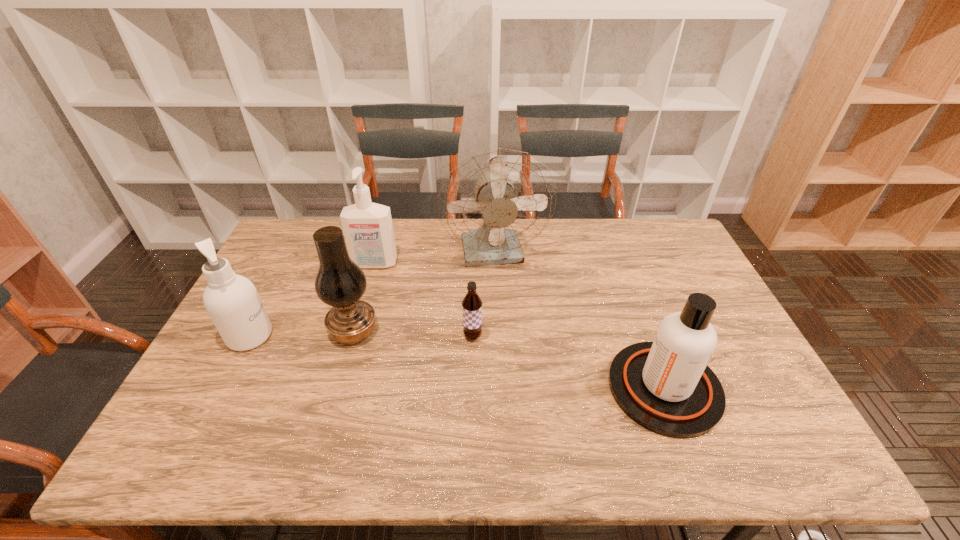
In order to click on unoccupied area between the fan and the rightmost object in this screenshot , I will do `click(580, 321)`.

This screenshot has height=540, width=960. I want to click on vacant point located between the leftmost cleansing agent and the second cleansing agent from left to right, so click(x=312, y=300).

Where is `vacant space in between the fan and the farthest cleansing agent`? This screenshot has height=540, width=960. vacant space in between the fan and the farthest cleansing agent is located at coordinates (435, 259).

Locate an element on the screen. The image size is (960, 540). object that stands as the closest to the rightmost cleansing agent is located at coordinates (494, 202).

Locate which object ranks fourth in proximity to the fan. Please provide its 2D coordinates. Your answer should be formatted as a tuple, i.e. [(x, y)], where the tuple contains the x and y coordinates of a point satisfying the conditions above.

[(665, 386)]

Locate an element on the screen. This screenshot has height=540, width=960. the second closest cleansing agent relative to the rightmost cleansing agent is located at coordinates (232, 301).

At what (x,y) coordinates should I click in order to perform the action: click on the closest cleansing agent to the leftmost object. Please return your answer as a coordinate pair (x, y). Image resolution: width=960 pixels, height=540 pixels. Looking at the image, I should click on (368, 230).

Where is `free space that satisfies the following two spatial constraints: 1. on the front label of the leftmost object; 2. on the left side of the rightmost cleansing agent`? free space that satisfies the following two spatial constraints: 1. on the front label of the leftmost object; 2. on the left side of the rightmost cleansing agent is located at coordinates (223, 388).

At what (x,y) coordinates should I click in order to perform the action: click on vacant space that satisfies the following two spatial constraints: 1. on the back side of the rightmost cleansing agent; 2. on the front label of the leftmost object. Please return your answer as a coordinate pair (x, y). This screenshot has height=540, width=960. Looking at the image, I should click on (645, 336).

Locate an element on the screen. vacant region that satisfies the following two spatial constraints: 1. in front of the rightmost cleansing agent to blow air; 2. on the left side of the fan is located at coordinates (501, 388).